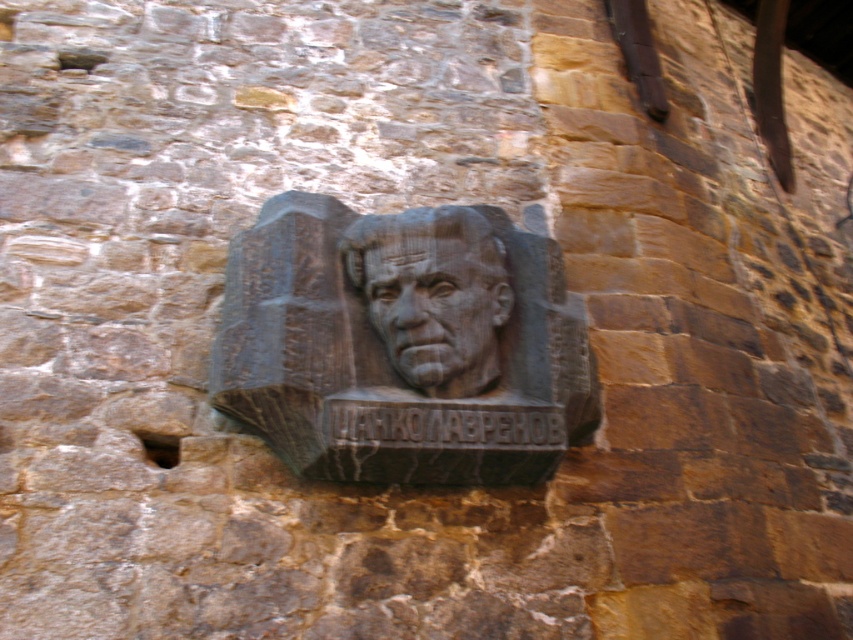
Question: Which point is closer to the camera taking this photo?

Choices:
 (A) (418, 349)
 (B) (505, 220)

Answer: (A)

Question: Which point appears farthest from the camera in this image?

Choices:
 (A) (332, 332)
 (B) (450, 307)

Answer: (B)

Question: Considering the relative positions of black stone relief at center and rough stone face at center in the image provided, where is black stone relief at center located with respect to rough stone face at center?

Choices:
 (A) right
 (B) left

Answer: (B)

Question: Is black stone relief at center wider than rough stone face at center?

Choices:
 (A) yes
 (B) no

Answer: (A)

Question: Considering the relative positions of black stone relief at center and rough stone face at center in the image provided, where is black stone relief at center located with respect to rough stone face at center?

Choices:
 (A) right
 (B) left

Answer: (B)